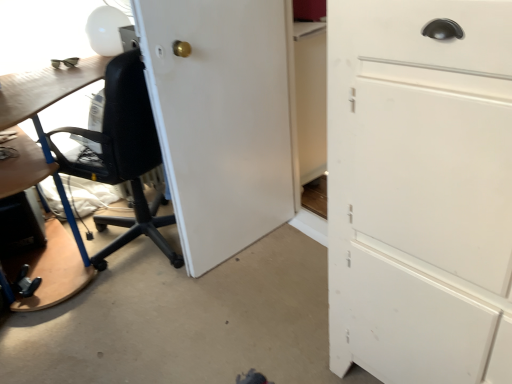
You are a GUI agent. You are given a task and a screenshot of the screen. Output one action in this format:
    pyautogui.click(x=<x>, y=<y>)
    Task: Click on the free spot below white matte door at center (from a real-world perspective)
    This screenshot has width=512, height=384.
    Given the screenshot: What is the action you would take?
    pyautogui.click(x=243, y=246)